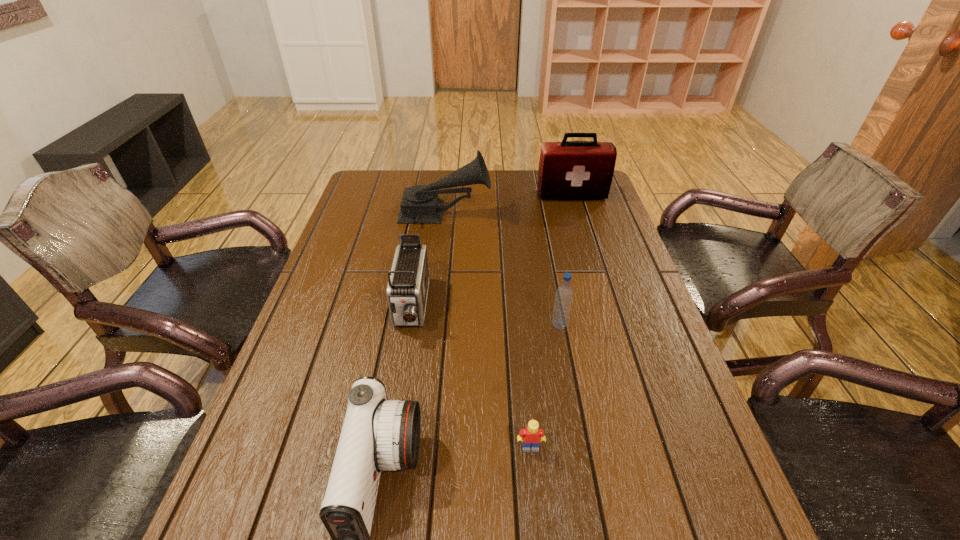
At what (x,y) coordinates should I click in order to perform the action: click on empty location between the first aid kit and the Lego. Please return your answer as a coordinate pair (x, y). The image size is (960, 540). Looking at the image, I should click on (551, 321).

The width and height of the screenshot is (960, 540). In order to click on vacant area that lies between the first aid kit and the water bottle in this screenshot , I will do `click(565, 260)`.

What are the coordinates of `free space between the third object from right to left and the phonograph_record` in the screenshot? It's located at (488, 330).

What are the coordinates of `free area in between the third object from right to left and the farther camcorder` in the screenshot? It's located at (470, 377).

I want to click on free spot between the phonograph_record and the water bottle, so click(502, 269).

Choose which object is the second nearest neighbor to the farther camcorder. Please provide its 2D coordinates. Your answer should be formatted as a tuple, i.e. [(x, y)], where the tuple contains the x and y coordinates of a point satisfying the conditions above.

[(420, 204)]

The height and width of the screenshot is (540, 960). What are the coordinates of `object that is the fifth closest to the phonograph_record` in the screenshot? It's located at (531, 436).

The height and width of the screenshot is (540, 960). I want to click on free space that satisfies the following two spatial constraints: 1. from the horn of the phonograph_record; 2. at the lens of the farther camcorder, so click(x=435, y=307).

This screenshot has height=540, width=960. In order to click on free space in the image that satisfies the following two spatial constraints: 1. on the side of the first aid kit with the cross symbol; 2. from the horn of the phonograph_record in this screenshot , I will do `click(577, 214)`.

Locate an element on the screen. The height and width of the screenshot is (540, 960). vacant space that satisfies the following two spatial constraints: 1. at the lens of the water bottle; 2. on the right side of the farther camcorder is located at coordinates (408, 326).